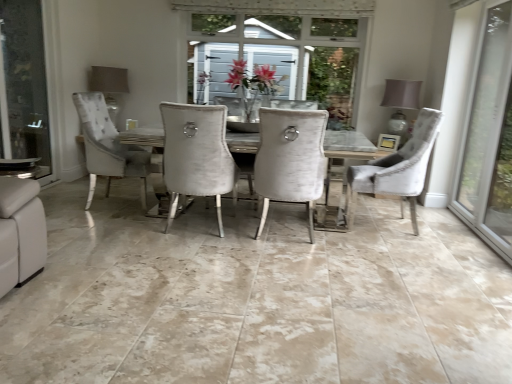
Identify the location of space that is in front of velvet white chair at center, placed as the first chair when sorted from left to right. The width and height of the screenshot is (512, 384). (291, 261).